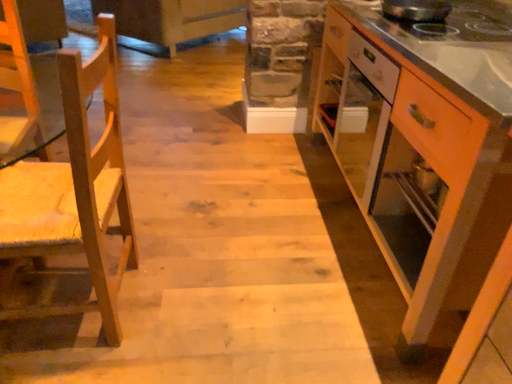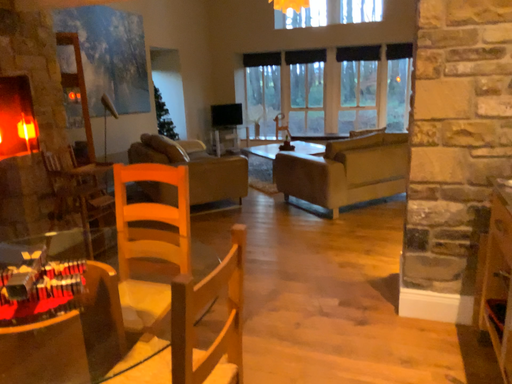
Question: Which way did the camera rotate in the video?

Choices:
 (A) rotated downward
 (B) rotated upward

Answer: (B)